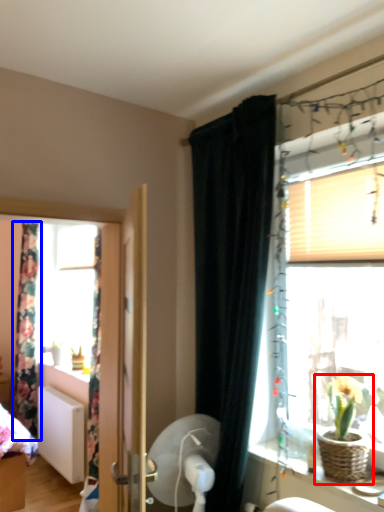
Question: Among these objects, which one is farthest to the camera, houseplant (highlighted by a red box) or curtain (highlighted by a blue box)?

Choices:
 (A) houseplant
 (B) curtain

Answer: (B)